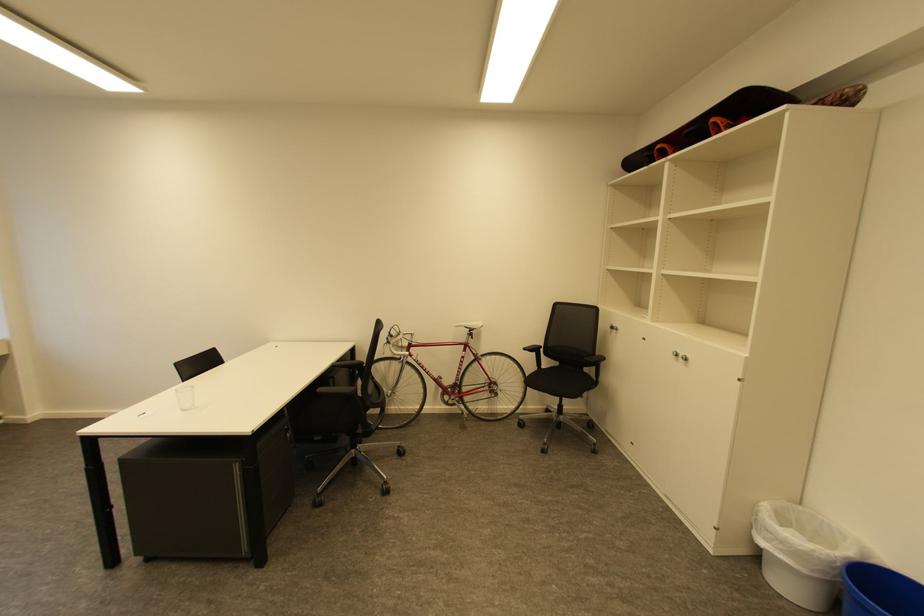
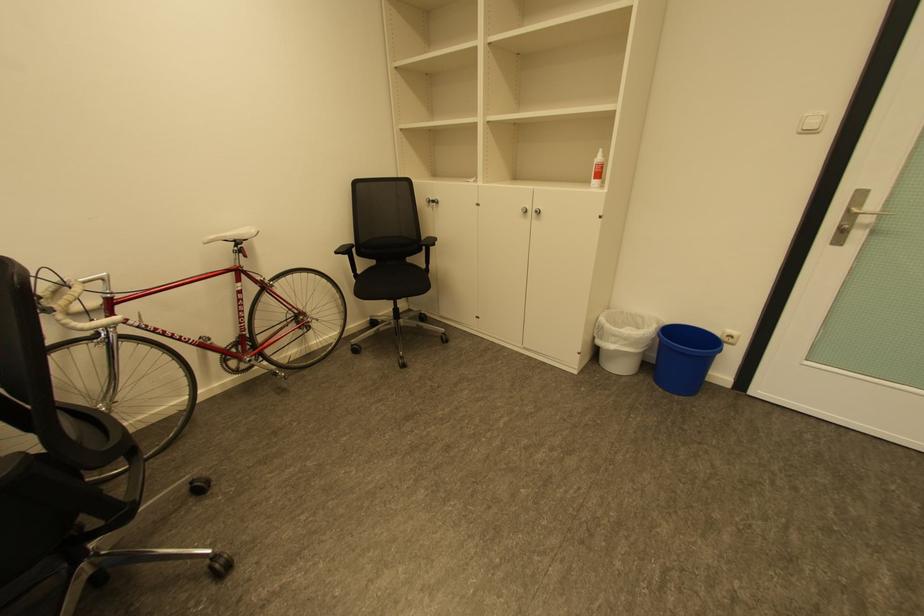
Locate, in the second image, the point that corresponds to the point at 477,329 in the first image.

(241, 241)